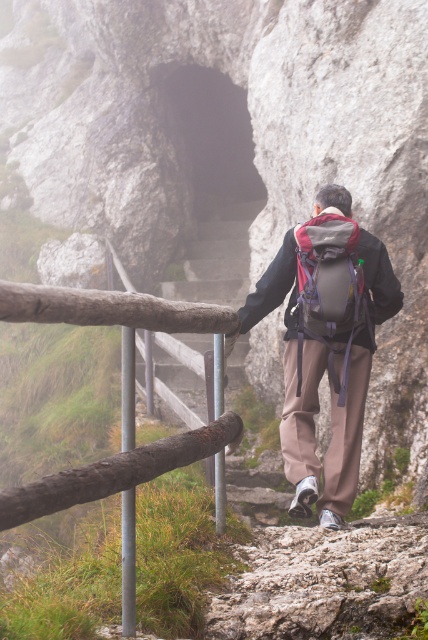
Is brown wooden fence at left shorter than gray fabric backpack at center?

Correct, brown wooden fence at left is not as tall as gray fabric backpack at center.

Between brown wooden fence at left and gray fabric backpack at center, which one has less height?

Standing shorter between the two is brown wooden fence at left.

Is point (160, 300) positioned after point (318, 328)?

No.

The width and height of the screenshot is (428, 640). I want to click on brown wooden fence at left, so click(115, 472).

Identify the location of matte gray backpack at center. This screenshot has height=640, width=428. (324, 362).

Based on the photo, does matte gray backpack at center appear under gray fabric backpack at center?

Correct, matte gray backpack at center is located below gray fabric backpack at center.

Is point (300, 456) farther from camera compared to point (330, 310)?

Yes, point (300, 456) is behind point (330, 310).

Find the location of a particular element. matte gray backpack at center is located at coordinates (324, 362).

Does matte gray backpack at center have a greater width compared to brown wooden fence at left?

Yes, matte gray backpack at center is wider than brown wooden fence at left.

How far apart are matte gray backpack at center and brown wooden fence at left?

matte gray backpack at center and brown wooden fence at left are 64.64 centimeters apart from each other.

Where is `matte gray backpack at center`? This screenshot has height=640, width=428. matte gray backpack at center is located at coordinates (324, 362).

The image size is (428, 640). Find the location of `matte gray backpack at center`. matte gray backpack at center is located at coordinates (324, 362).